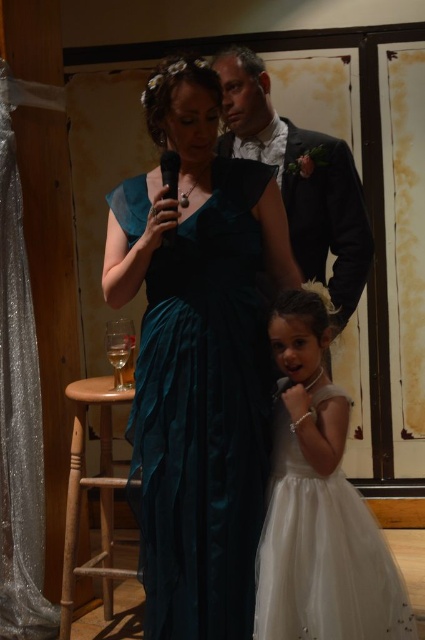
Question: Considering the relative positions of teal satin dress at center and wooden stool at lower left in the image provided, where is teal satin dress at center located with respect to wooden stool at lower left?

Choices:
 (A) below
 (B) above

Answer: (B)

Question: Which point is closer to the camera?

Choices:
 (A) pos(365,216)
 (B) pos(308,496)

Answer: (B)

Question: Is white satin dress at center further to the viewer compared to wooden stool at lower left?

Choices:
 (A) no
 (B) yes

Answer: (A)

Question: Which point appears farthest from the camera in this image?

Choices:
 (A) (357, 618)
 (B) (269, 157)
 (C) (81, 444)

Answer: (C)

Question: Which point appears farthest from the camera in this image?

Choices:
 (A) (339, 250)
 (B) (277, 554)
 (C) (189, 177)

Answer: (A)

Question: Considering the relative positions of white satin dress at center and shiny black suit at center in the image provided, where is white satin dress at center located with respect to shiny black suit at center?

Choices:
 (A) left
 (B) right

Answer: (B)